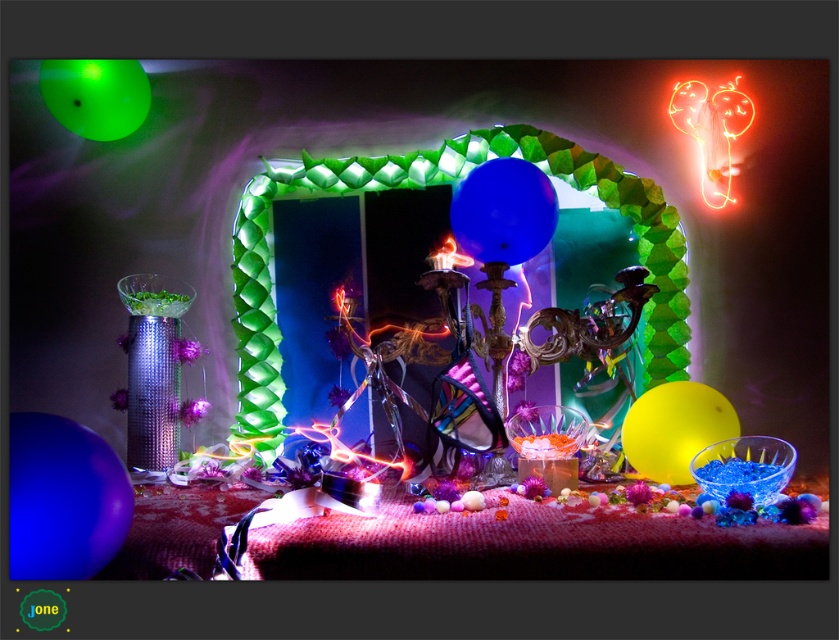
Question: Among these points, which one is farthest from the camera?

Choices:
 (A) (671, 444)
 (B) (73, 474)

Answer: (A)

Question: Which of the following is the farthest from the observer?

Choices:
 (A) yellow matte balloon at center
 (B) matte blue balloon at center
 (C) green translucent balloon at upper left
 (D) matte blue balloon at lower left

Answer: (C)

Question: Is matte blue balloon at center smaller than yellow matte balloon at center?

Choices:
 (A) yes
 (B) no

Answer: (A)

Question: Can you confirm if matte blue balloon at lower left is thinner than matte blue balloon at center?

Choices:
 (A) no
 (B) yes

Answer: (B)

Question: Which is farther from the matte blue balloon at lower left?

Choices:
 (A) matte blue balloon at center
 (B) green translucent balloon at upper left
 (C) yellow matte balloon at center

Answer: (B)

Question: Is matte blue balloon at center further to camera compared to green translucent balloon at upper left?

Choices:
 (A) yes
 (B) no

Answer: (B)